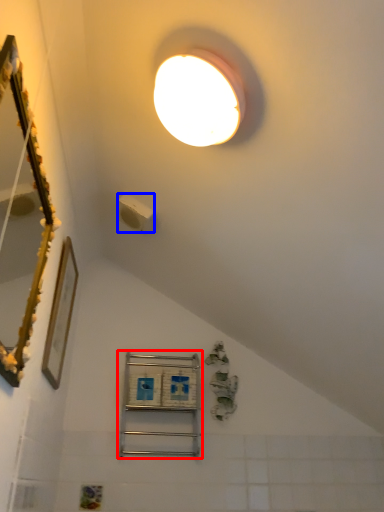
Question: Which of the following is the closest to the observer, shelf (highlighted by a red box) or light switch (highlighted by a blue box)?

Choices:
 (A) shelf
 (B) light switch

Answer: (B)